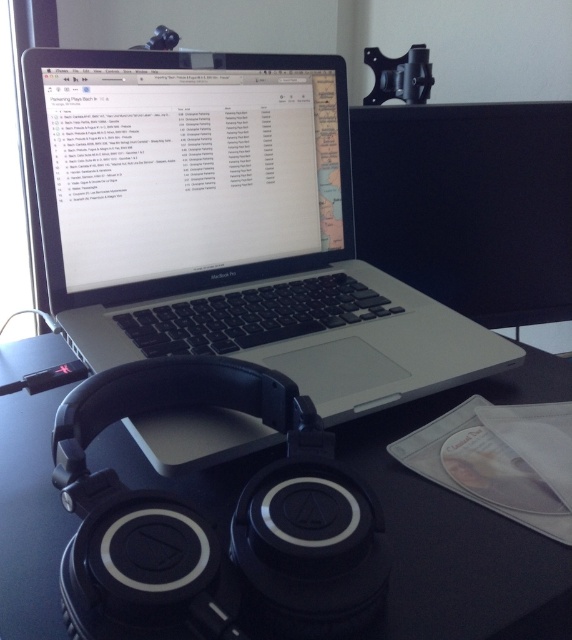
Question: Does satin black laptop at center appear over black glossy monitor at upper center?

Choices:
 (A) yes
 (B) no

Answer: (B)

Question: Which point appears farthest from the camera in this image?

Choices:
 (A) (47, 636)
 (B) (148, 148)
 (C) (442, 214)

Answer: (C)

Question: Does sleek silver laptop at center have a lesser width compared to black matte headphones at center?

Choices:
 (A) no
 (B) yes

Answer: (B)

Question: Which object is closer to the camera taking this photo?

Choices:
 (A) satin black laptop at center
 (B) sleek silver laptop at center
 (C) black glossy monitor at upper center

Answer: (B)

Question: Observing the image, what is the correct spatial positioning of sleek silver laptop at center in reference to satin black laptop at center?

Choices:
 (A) right
 (B) left

Answer: (A)

Question: Among these points, which one is nearest to the camera?

Choices:
 (A) (59, 532)
 (B) (328, 140)
 (C) (494, 278)

Answer: (A)